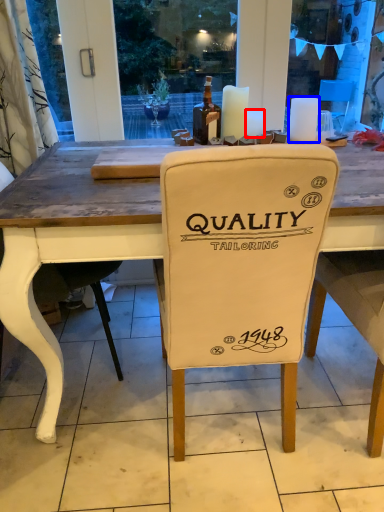
Question: Among these objects, which one is nearest to the camera, candle (highlighted by a red box) or candle (highlighted by a blue box)?

Choices:
 (A) candle
 (B) candle

Answer: (B)